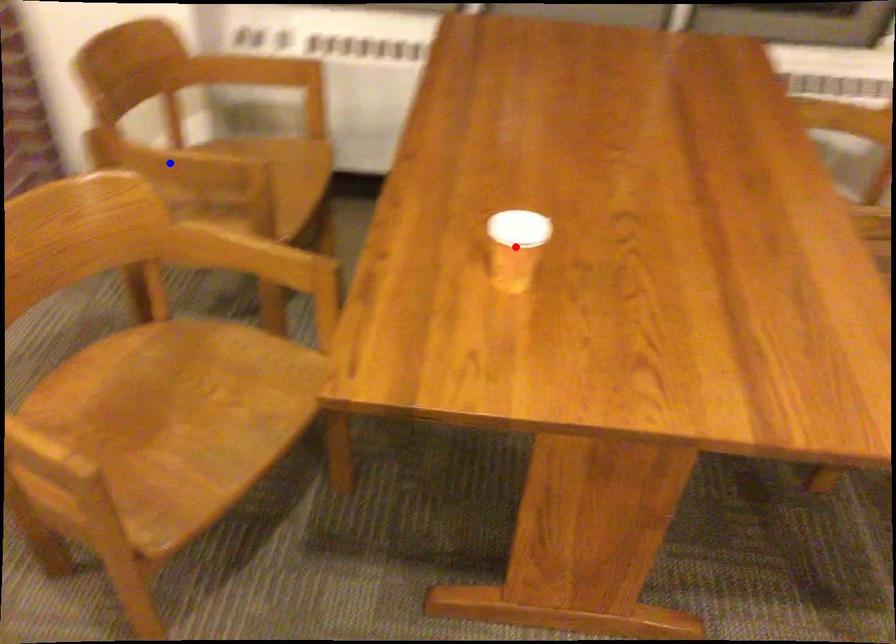
Question: In the image, two points are highlighted. Which point is nearer to the camera? Reply with the corresponding letter.

Choices:
 (A) blue point
 (B) red point

Answer: (B)